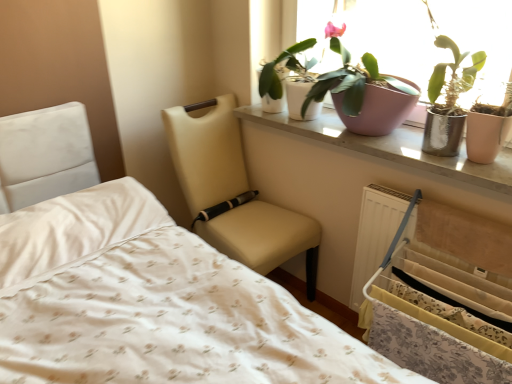
The height and width of the screenshot is (384, 512). I want to click on pink ceramic pots at upper right, so click(x=377, y=39).

Identify the location of pink ceramic pots at upper right. (377, 39).

Is point (490, 173) farther from viewer compared to point (440, 60)?

No, (490, 173) is closer to viewer.

Is pink ceramic window sill at upper center inside the boundaries of pink ceramic pots at upper right, or outside?

pink ceramic window sill at upper center is not inside pink ceramic pots at upper right, it's outside.

Is pink ceramic window sill at upper center taller than pink ceramic pots at upper right?

Incorrect, the height of pink ceramic window sill at upper center is not larger of that of pink ceramic pots at upper right.

In the image, is pink ceramic window sill at upper center on the left side or the right side of pink ceramic pots at upper right?

In the image, pink ceramic window sill at upper center appears on the left side of pink ceramic pots at upper right.

In the scene shown: Considering the sizes of beige leather chair at center and white fabric bed frame at lower right in the image, is beige leather chair at center wider or thinner than white fabric bed frame at lower right?

beige leather chair at center is wider than white fabric bed frame at lower right.

Who is shorter, beige leather chair at center or white fabric bed frame at lower right?

white fabric bed frame at lower right is shorter.

Considering the positions of objects beige leather chair at center and white fabric bed frame at lower right in the image provided, who is more to the right, beige leather chair at center or white fabric bed frame at lower right?

Positioned to the right is white fabric bed frame at lower right.

From the image's perspective, is pink ceramic pots at upper right on white fabric bed frame at lower right?

Indeed, from the image's perspective, pink ceramic pots at upper right is shown above white fabric bed frame at lower right.

Is pink ceramic pots at upper right completely or partially outside of white fabric bed frame at lower right?

Absolutely, pink ceramic pots at upper right is external to white fabric bed frame at lower right.

Which is behind, pink ceramic pots at upper right or white fabric bed frame at lower right?

pink ceramic pots at upper right is further from the camera.

Who is taller, pink ceramic pots at upper right or white fabric bed frame at lower right?

Standing taller between the two is white fabric bed frame at lower right.

Is pink ceramic pots at upper right spatially inside beige leather chair at center, or outside of it?

pink ceramic pots at upper right is not inside beige leather chair at center, it's outside.

From the picture: From the image's perspective, relative to beige leather chair at center, is pink ceramic pots at upper right above or below?

Based on their image positions, pink ceramic pots at upper right is located above beige leather chair at center.

From a real-world perspective, is pink ceramic pots at upper right on top of beige leather chair at center?

Yes, from a real-world perspective, pink ceramic pots at upper right is on top of beige leather chair at center.

From a real-world perspective, is pink ceramic pots at upper right under pink matte pot at upper center, marked as the 2th houseplant in a left-to-right arrangement?

Answer: Actually, pink ceramic pots at upper right is physically above pink matte pot at upper center, marked as the 2th houseplant in a left-to-right arrangement, in the real world.

From a real-world perspective, count 1st houseplants downward from the pink ceramic pots at upper right and point to it. Please provide its 2D coordinates.

[(362, 91)]

Consider the image. Which object is thinner, pink ceramic pots at upper right or pink matte pot at upper center, the first houseplant from the right?

pink ceramic pots at upper right.

Is pink ceramic pots at upper right facing away from pink matte pot at upper center, marked as the 2th houseplant in a left-to-right arrangement?

That's right, pink ceramic pots at upper right is facing away from pink matte pot at upper center, marked as the 2th houseplant in a left-to-right arrangement.

Is white glossy pot at upper center, marked as the first houseplant in a left-to-right arrangement, not close to pink ceramic pots at upper right?

No, there isn't a large distance between white glossy pot at upper center, marked as the first houseplant in a left-to-right arrangement, and pink ceramic pots at upper right.

From a real-world perspective, is white glossy pot at upper center, marked as the first houseplant in a left-to-right arrangement, physically below pink ceramic pots at upper right?

Yes.

Considering the positions of point (288, 50) and point (388, 48), is point (288, 50) closer or farther from the camera than point (388, 48)?

Point (288, 50) appears to be farther away from the viewer than point (388, 48).

Find the location of `houseplant above the pink ceramic pots at upper right (from the image's perspective)`. houseplant above the pink ceramic pots at upper right (from the image's perspective) is located at coordinates (287, 69).

From a real-world perspective, is beige leather chair at center above or below pink ceramic window sill at upper center?

beige leather chair at center is situated lower than pink ceramic window sill at upper center in the real world.

Can you confirm if beige leather chair at center is smaller than pink ceramic window sill at upper center?

No.

From the image's perspective, does beige leather chair at center appear lower than pink ceramic window sill at upper center?

Yes.

Which object is wider, beige leather chair at center or pink ceramic window sill at upper center?

beige leather chair at center.

Where is `window above the pink ceramic window sill at upper center (from a real-world perspective)`? Image resolution: width=512 pixels, height=384 pixels. window above the pink ceramic window sill at upper center (from a real-world perspective) is located at coordinates (377, 39).

The width and height of the screenshot is (512, 384). What are the coordinates of `bed frame below the beige leather chair at center (from the image's perspective)` in the screenshot? It's located at (438, 318).

Which object lies nearer to the anchor point pink ceramic window sill at upper center, white glossy pot at upper center, the second houseplant viewed from the right, or white fabric bed frame at lower right?

Among the two, white glossy pot at upper center, the second houseplant viewed from the right, is located nearer to pink ceramic window sill at upper center.

From the picture: Considering their positions, is pink matte pot at upper center, marked as the 2th houseplant in a left-to-right arrangement, positioned closer to white fabric bed frame at lower right than white glossy pot at upper center, the second houseplant viewed from the right?

pink matte pot at upper center, marked as the 2th houseplant in a left-to-right arrangement.

Based on their spatial positions, is pink ceramic pots at upper right or white fabric bed frame at lower right further from beige leather chair at center?

pink ceramic pots at upper right.

Consider the image. From the image, which object appears to be farther from white fabric bed frame at lower right, pink ceramic pots at upper right or pink ceramic window sill at upper center?

pink ceramic pots at upper right lies further to white fabric bed frame at lower right than the other object.

From the image, which object appears to be farther from white fabric bed frame at lower right, pink matte pot at upper center, marked as the 2th houseplant in a left-to-right arrangement, or pink ceramic window sill at upper center?

pink matte pot at upper center, marked as the 2th houseplant in a left-to-right arrangement, is positioned further to the anchor white fabric bed frame at lower right.

Considering their positions, is white glossy pot at upper center, marked as the first houseplant in a left-to-right arrangement, positioned further to pink ceramic window sill at upper center than pink matte pot at upper center, the first houseplant from the right?

Based on the image, white glossy pot at upper center, marked as the first houseplant in a left-to-right arrangement, appears to be further to pink ceramic window sill at upper center.

Looking at the image, which one is located further to beige leather chair at center, pink ceramic pots at upper right or white glossy pot at upper center, the second houseplant viewed from the right?

The object further to beige leather chair at center is pink ceramic pots at upper right.

Which object lies further to the anchor point pink ceramic window sill at upper center, beige leather chair at center or white fabric bed frame at lower right?

The object further to pink ceramic window sill at upper center is beige leather chair at center.

At what (x,y) coordinates should I click in order to perform the action: click on houseplant between pink ceramic window sill at upper center and white glossy pot at upper center, the second houseplant viewed from the right, from front to back. Please return your answer as a coordinate pair (x, y). Looking at the image, I should click on (362, 91).

Locate an element on the screen. window sill between white glossy pot at upper center, the second houseplant viewed from the right, and pink ceramic pots at upper right is located at coordinates (391, 148).

You are a GUI agent. You are given a task and a screenshot of the screen. Output one action in this format:
    pyautogui.click(x=<x>, y=<y>)
    Task: Click on the window sill between pink matte pot at upper center, the first houseplant from the right, and pink ceramic pots at upper right from left to right
    The height and width of the screenshot is (384, 512).
    Given the screenshot: What is the action you would take?
    pyautogui.click(x=391, y=148)

Where is `chair between pink ceramic window sill at upper center and white fabric bed frame at lower right in the vertical direction`? chair between pink ceramic window sill at upper center and white fabric bed frame at lower right in the vertical direction is located at coordinates (234, 193).